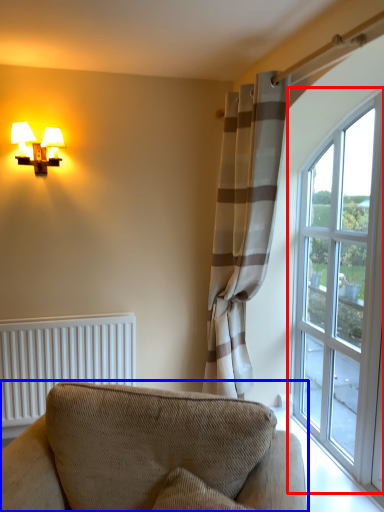
Question: Which point is closer to the camera, window (highlighted by a red box) or studio couch (highlighted by a blue box)?

Choices:
 (A) window
 (B) studio couch

Answer: (B)